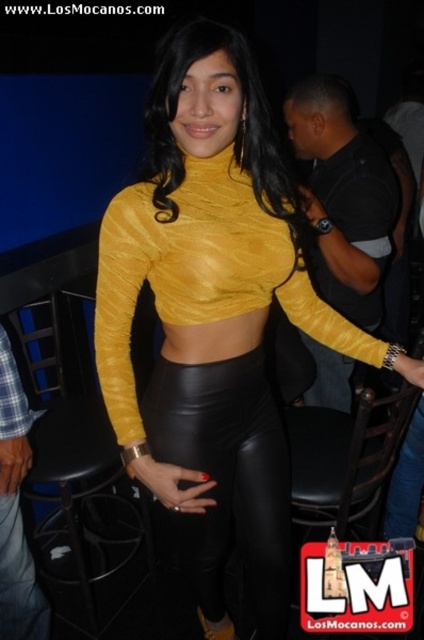
Question: Which of the following is the farthest from the observer?

Choices:
 (A) black leather bar stool at lower center
 (B) black leather skirt at center

Answer: (A)

Question: Does black leather skirt at center appear under black leather bar stool at lower center?

Choices:
 (A) yes
 (B) no

Answer: (B)

Question: Which object is farther from the camera taking this photo?

Choices:
 (A) black leather skirt at center
 (B) black leather bar stool at lower center

Answer: (B)

Question: Is black leather skirt at center thinner than black leather bar stool at lower center?

Choices:
 (A) no
 (B) yes

Answer: (A)

Question: Considering the relative positions of black leather skirt at center and black leather bar stool at lower center in the image provided, where is black leather skirt at center located with respect to black leather bar stool at lower center?

Choices:
 (A) right
 (B) left

Answer: (A)

Question: Which point is farther from the camera taking this photo?

Choices:
 (A) (276, 404)
 (B) (80, 448)

Answer: (B)